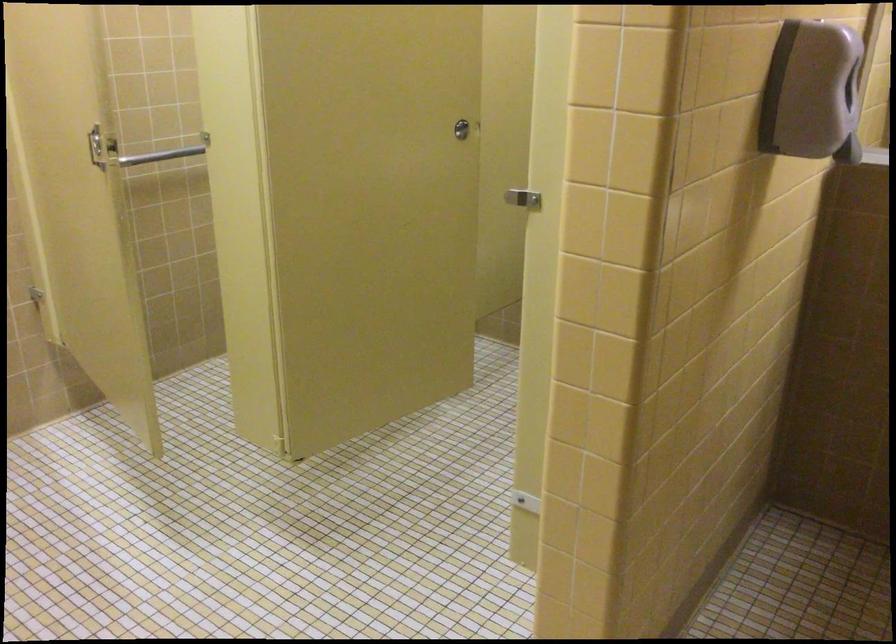
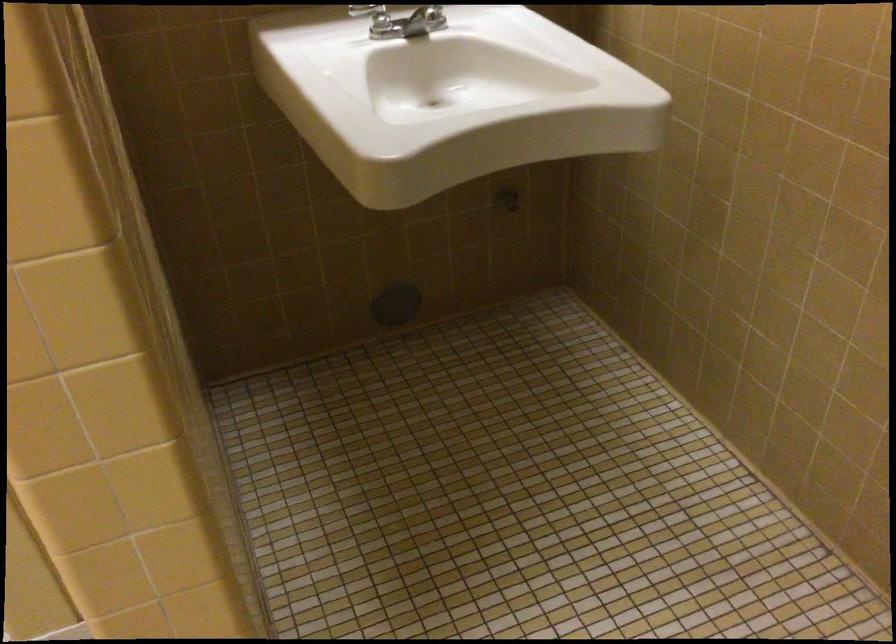
The first image is from the beginning of the video and the second image is from the end. How did the camera likely rotate when shooting the video?

The rotation direction of the camera is right-down.